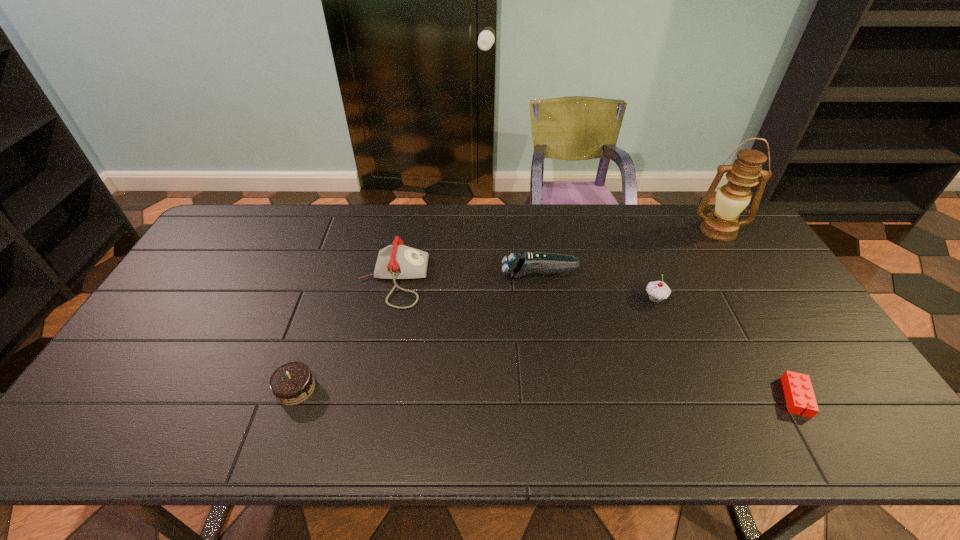
Locate an element on the screen. Image resolution: width=960 pixels, height=540 pixels. free space located on the head of the fourth object from right to left is located at coordinates (420, 274).

Where is `free spot located 0.080m on the head of the fourth object from right to left`? free spot located 0.080m on the head of the fourth object from right to left is located at coordinates (475, 274).

Locate an element on the screen. This screenshot has width=960, height=540. free location located on the head of the fourth object from right to left is located at coordinates (456, 274).

Identify the location of vacant space positioned 0.400m on the dial of the telephone. This screenshot has width=960, height=540. (557, 279).

Find the location of a particular element. The image size is (960, 540). vacant space located on the right of the chocolate cake is located at coordinates (437, 389).

The height and width of the screenshot is (540, 960). In order to click on free region located 0.200m on the back of the shortest object in this screenshot , I will do `click(750, 317)`.

Identify the location of object at the far edge. The height and width of the screenshot is (540, 960). (731, 199).

Image resolution: width=960 pixels, height=540 pixels. Find the location of `object at the near edge`. object at the near edge is located at coordinates (798, 390).

Find the location of a particular element. Image resolution: width=960 pixels, height=540 pixels. oil lamp that is at the right edge is located at coordinates (731, 199).

The width and height of the screenshot is (960, 540). What are the coordinates of `Lego located at the right edge` in the screenshot? It's located at (798, 390).